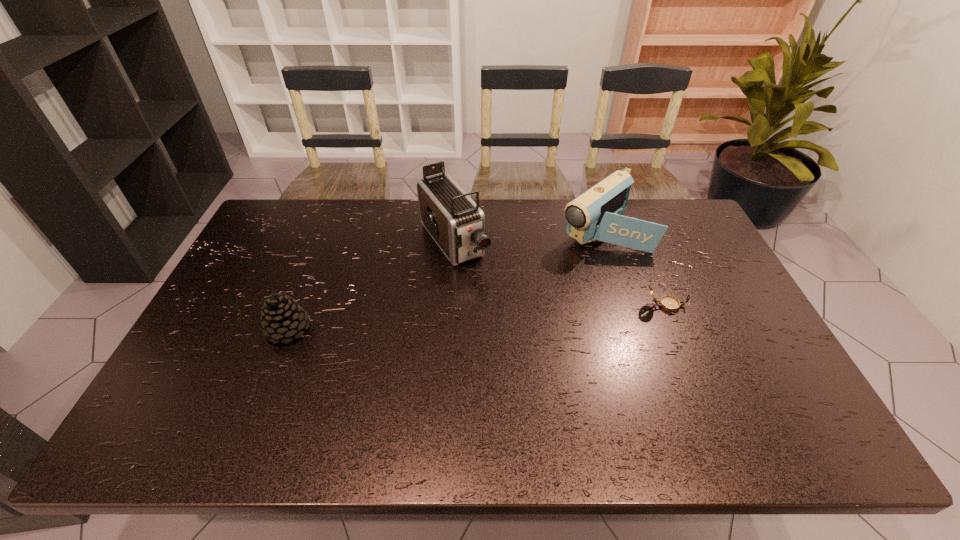
You are a GUI agent. You are given a task and a screenshot of the screen. Output one action in this format:
    pyautogui.click(x=<x>, y=<y>)
    Task: Click on the blank area located on the side of the shorter camcorder with the flip-out screen
    
    Given the screenshot: What is the action you would take?
    pyautogui.click(x=542, y=273)

Identify the location of free region located on the side of the shorter camcorder with the flip-out screen. (532, 281).

Identify the location of free location located 0.270m on the side of the shorter camcorder with the flip-out screen. The image size is (960, 540). (521, 289).

Identify the location of vacant space located 0.270m at the lens of the tallest object. (516, 329).

I want to click on free location located 0.090m at the lens of the tallest object, so click(484, 288).

This screenshot has width=960, height=540. What are the coordinates of `blank space located 0.100m at the lens of the tallest object` in the screenshot? It's located at (486, 290).

Find the location of a particular element. This screenshot has height=540, width=960. object that is at the right edge is located at coordinates (668, 303).

In the image, there is a desktop. Identify the location of vacant space at the far edge. The width and height of the screenshot is (960, 540). (532, 213).

The image size is (960, 540). In order to click on vacant region at the near edge of the desktop in this screenshot , I will do `click(362, 399)`.

This screenshot has width=960, height=540. In the image, there is a desktop. Identify the location of vacant region at the left edge. (x=238, y=274).